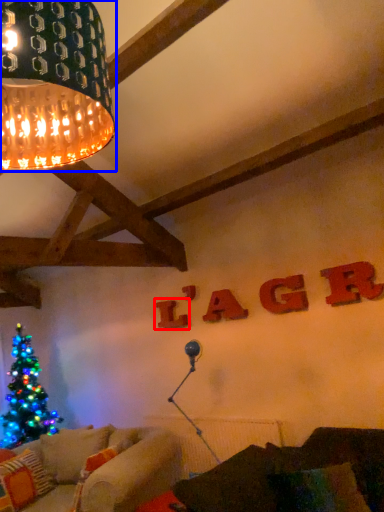
Question: Which object is further to the camera taking this photo, letter (highlighted by a red box) or lamp (highlighted by a blue box)?

Choices:
 (A) letter
 (B) lamp

Answer: (A)